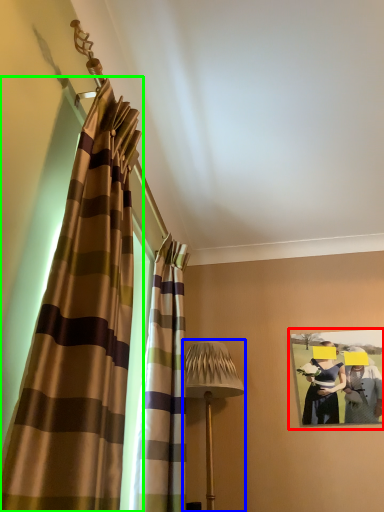
Question: Which is nearer to the picture frame (highlighted by a red box)? table lamp (highlighted by a blue box) or curtain (highlighted by a green box).

Choices:
 (A) table lamp
 (B) curtain

Answer: (A)